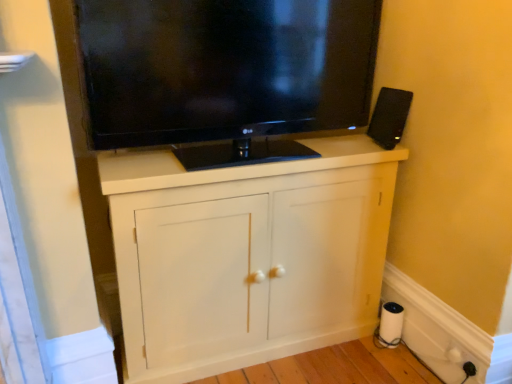
Question: Considering the positions of white matte cabinet at center and white plastic outlet at lower right, which is the 1th electric outlet from left to right, in the image, is white matte cabinet at center taller or shorter than white plastic outlet at lower right, which is the 1th electric outlet from left to right,?

Choices:
 (A) short
 (B) tall

Answer: (B)

Question: Considering their positions, is white matte cabinet at center located in front of or behind white plastic outlet at lower right, acting as the 2th electric outlet starting from the right?

Choices:
 (A) behind
 (B) front

Answer: (B)

Question: Estimate the real-world distances between objects in this image. Which object is farther from the white plastic outlet at lower right, which is the 1th electric outlet from left to right?

Choices:
 (A) white matte paper towel at lower right
 (B) white matte cabinet at center
 (C) black plastic speaker at upper right
 (D) white plastic electric outlet at lower right, the 2th electric outlet when ordered from left to right
 (E) black glossy tv at upper center

Answer: (E)

Question: Estimate the real-world distances between objects in this image. Which object is closer to the black glossy tv at upper center?

Choices:
 (A) white matte cabinet at center
 (B) white plastic outlet at lower right, which is the 1th electric outlet from left to right
 (C) white plastic electric outlet at lower right, which is the 1th electric outlet in right-to-left order
 (D) white matte paper towel at lower right
 (E) black plastic speaker at upper right

Answer: (A)